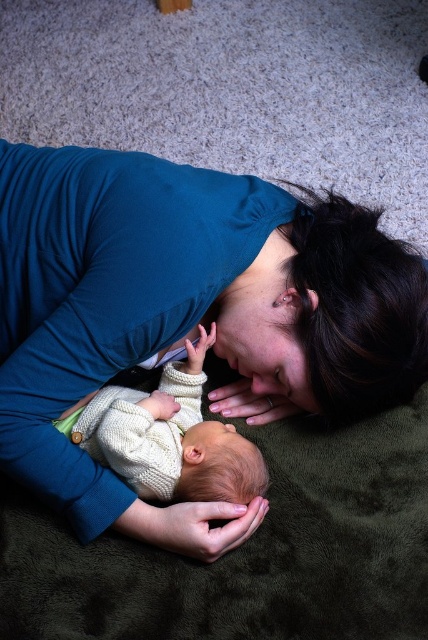
You are a photographer taking a picture of the blue fabric at center and the knitted cream sweater at center. Which one is positioned higher in the image?

The blue fabric at center is above the knitted cream sweater at center, so the blue fabric at center is positioned higher in the image.

What is located at the coordinates point (187, 314)?

The point (187, 314) corresponds to blue fabric at center.